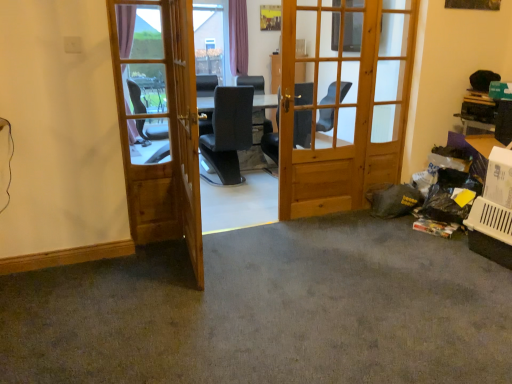
Find the location of a particular element. Image resolution: width=512 pixels, height=384 pixels. free space in front of light brown wooden screen door at center is located at coordinates (183, 301).